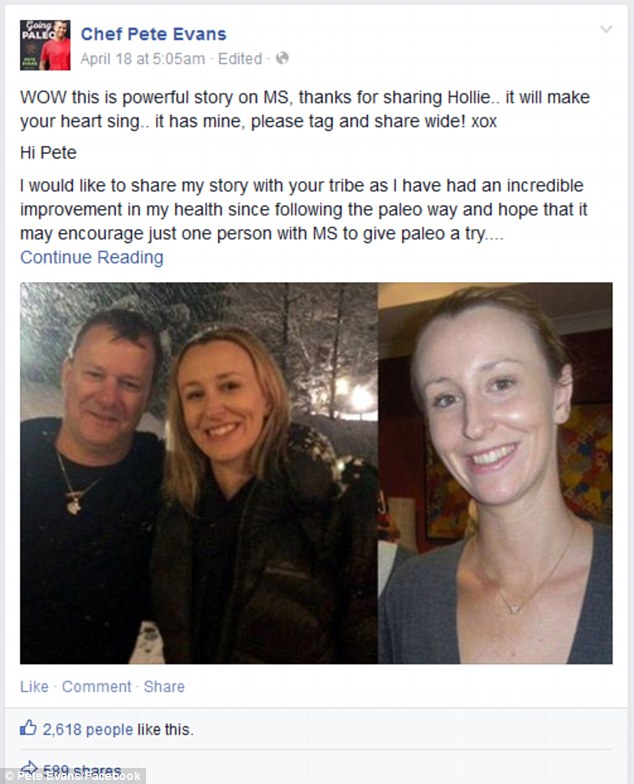
Locate an element on the screen. This screenshot has width=634, height=784. light source is located at coordinates (363, 401), (27, 300).